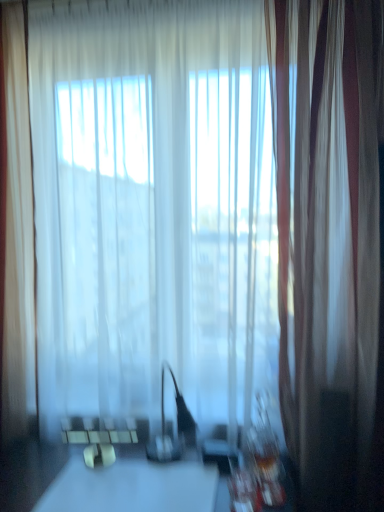
The image size is (384, 512). What do you see at coordinates (230, 247) in the screenshot?
I see `transparent fabric at center` at bounding box center [230, 247].

You are a GUI agent. You are given a task and a screenshot of the screen. Output one action in this format:
    pyautogui.click(x=<x>, y=<y>)
    Task: Click on the translucent white curtain at left, the first curtain positioned from the left
    
    Given the screenshot: What is the action you would take?
    pyautogui.click(x=18, y=240)

This screenshot has width=384, height=512. In order to click on transparent fabric at center in this screenshot , I will do tap(230, 247).

In order to click on the 1st curtain behind the white glossy table at center, counting from the anchor's position in this screenshot , I will do `click(330, 245)`.

Considering the sizes of objects white glossy table at center and silky white curtain at right, the second curtain in the left-to-right sequence, in the image provided, who is bigger, white glossy table at center or silky white curtain at right, the second curtain in the left-to-right sequence,?

With larger size is silky white curtain at right, the second curtain in the left-to-right sequence.

From the picture: From a real-world perspective, who is located higher, white glossy table at center or silky white curtain at right, the first curtain in the right-to-left sequence?

silky white curtain at right, the first curtain in the right-to-left sequence, from a real-world perspective.

Does white glossy table at center have a lesser height compared to silky white curtain at right, the first curtain in the right-to-left sequence?

Correct, white glossy table at center is not as tall as silky white curtain at right, the first curtain in the right-to-left sequence.

Based on the photo, from a real-world perspective, is transparent fabric at center below silky white curtain at right, the second curtain in the left-to-right sequence?

No, from a real-world perspective, transparent fabric at center is not below silky white curtain at right, the second curtain in the left-to-right sequence.

Would you say silky white curtain at right, the second curtain in the left-to-right sequence, is part of transparent fabric at center's contents?

Definitely not — silky white curtain at right, the second curtain in the left-to-right sequence, is not inside transparent fabric at center.

Which of these two, transparent fabric at center or silky white curtain at right, the second curtain in the left-to-right sequence, is smaller?

silky white curtain at right, the second curtain in the left-to-right sequence, is smaller.

Is point (72, 155) farther from camera compared to point (380, 80)?

Yes, point (72, 155) is farther from viewer.

From the image's perspective, is silky white curtain at right, the first curtain in the right-to-left sequence, located above or below transparent fabric at center?

Based on their image positions, silky white curtain at right, the first curtain in the right-to-left sequence, is located beneath transparent fabric at center.

Between silky white curtain at right, the first curtain in the right-to-left sequence, and transparent fabric at center, which one has larger size?

With larger size is transparent fabric at center.

Which object is thinner, silky white curtain at right, the first curtain in the right-to-left sequence, or transparent fabric at center?

Thinner between the two is transparent fabric at center.

Locate an element on the screen. The image size is (384, 512). table located below the translucent white curtain at left, the first curtain positioned from the left (from the image's perspective) is located at coordinates (132, 485).

Looking at this image, does white glossy table at center lie behind translucent white curtain at left, arranged as the second curtain when viewed from the right?

No, it is not.

Does white glossy table at center touch translucent white curtain at left, arranged as the second curtain when viewed from the right?

No, white glossy table at center is not making contact with translucent white curtain at left, arranged as the second curtain when viewed from the right.

Based on the photo, how many degrees apart are the facing directions of white glossy table at center and translucent white curtain at left, the first curtain positioned from the left?

The angular difference between white glossy table at center and translucent white curtain at left, the first curtain positioned from the left, is 1.57 degrees.

From the image's perspective, is white glossy table at center beneath transparent fabric at center?

Yes, from the image's perspective, white glossy table at center is beneath transparent fabric at center.

Measure the distance from white glossy table at center to transparent fabric at center.

white glossy table at center and transparent fabric at center are 26.59 inches apart.

Who is bigger, white glossy table at center or transparent fabric at center?

transparent fabric at center is bigger.

Which object is further away from the camera taking this photo, white glossy table at center or transparent fabric at center?

transparent fabric at center is behind.

Considering the sizes of objects silky white curtain at right, the second curtain in the left-to-right sequence, and white glossy table at center in the image provided, who is thinner, silky white curtain at right, the second curtain in the left-to-right sequence, or white glossy table at center?

With smaller width is silky white curtain at right, the second curtain in the left-to-right sequence.

Considering the positions of points (346, 273) and (112, 504), is point (346, 273) farther from camera compared to point (112, 504)?

Yes.

In the image, is silky white curtain at right, the first curtain in the right-to-left sequence, on the left side or the right side of white glossy table at center?

In the image, silky white curtain at right, the first curtain in the right-to-left sequence, appears on the right side of white glossy table at center.

From a real-world perspective, is silky white curtain at right, the second curtain in the left-to-right sequence, on white glossy table at center?

Yes, from a real-world perspective, silky white curtain at right, the second curtain in the left-to-right sequence, is above white glossy table at center.

Between transparent fabric at center and translucent white curtain at left, the first curtain positioned from the left, which one has less height?

transparent fabric at center.

From the image's perspective, which object appears higher, transparent fabric at center or translucent white curtain at left, arranged as the second curtain when viewed from the right?

translucent white curtain at left, arranged as the second curtain when viewed from the right.

Does transparent fabric at center contain translucent white curtain at left, the first curtain positioned from the left?

No, translucent white curtain at left, the first curtain positioned from the left, is not a part of transparent fabric at center.

Considering the sizes of transparent fabric at center and translucent white curtain at left, the first curtain positioned from the left, in the image, is transparent fabric at center wider or thinner than translucent white curtain at left, the first curtain positioned from the left,?

In the image, transparent fabric at center appears to be more narrow than translucent white curtain at left, the first curtain positioned from the left.

I want to click on the 1st curtain directly above the white glossy table at center (from a real-world perspective), so click(330, 245).

The width and height of the screenshot is (384, 512). Find the location of `bay window above the silky white curtain at right, the first curtain in the right-to-left sequence (from the image's perspective)`. bay window above the silky white curtain at right, the first curtain in the right-to-left sequence (from the image's perspective) is located at coordinates (230, 247).

Based on their spatial positions, is transparent fabric at center or silky white curtain at right, the second curtain in the left-to-right sequence, further from white glossy table at center?

silky white curtain at right, the second curtain in the left-to-right sequence, is further to white glossy table at center.

Which object lies further to the anchor point white glossy table at center, silky white curtain at right, the second curtain in the left-to-right sequence, or transparent fabric at center?

Among the two, silky white curtain at right, the second curtain in the left-to-right sequence, is located further to white glossy table at center.

Estimate the real-world distances between objects in this image. Which object is further from transparent fabric at center, white glossy table at center or translucent white curtain at left, the first curtain positioned from the left?

white glossy table at center.

Considering their positions, is translucent white curtain at left, the first curtain positioned from the left, positioned further to transparent fabric at center than silky white curtain at right, the first curtain in the right-to-left sequence?

Based on the image, translucent white curtain at left, the first curtain positioned from the left, appears to be further to transparent fabric at center.

Looking at this image, considering their positions, is translucent white curtain at left, arranged as the second curtain when viewed from the right, positioned further to silky white curtain at right, the second curtain in the left-to-right sequence, than white glossy table at center?

Among the two, translucent white curtain at left, arranged as the second curtain when viewed from the right, is located further to silky white curtain at right, the second curtain in the left-to-right sequence.

Looking at the image, which one is located further to translucent white curtain at left, arranged as the second curtain when viewed from the right, transparent fabric at center or white glossy table at center?

Among the two, white glossy table at center is located further to translucent white curtain at left, arranged as the second curtain when viewed from the right.

From the image, which object appears to be farther from transparent fabric at center, silky white curtain at right, the second curtain in the left-to-right sequence, or translucent white curtain at left, the first curtain positioned from the left?

translucent white curtain at left, the first curtain positioned from the left, lies further to transparent fabric at center than the other object.

Considering their positions, is transparent fabric at center positioned closer to translucent white curtain at left, the first curtain positioned from the left, than silky white curtain at right, the first curtain in the right-to-left sequence?

transparent fabric at center.

At what (x,y) coordinates should I click in order to perform the action: click on bay window between translucent white curtain at left, the first curtain positioned from the left, and white glossy table at center, in the vertical direction. Please return your answer as a coordinate pair (x, y). Image resolution: width=384 pixels, height=512 pixels. Looking at the image, I should click on (230, 247).

At what (x,y) coordinates should I click in order to perform the action: click on curtain that lies between transparent fabric at center and white glossy table at center from top to bottom. Please return your answer as a coordinate pair (x, y). Looking at the image, I should click on (330, 245).

I want to click on table between translucent white curtain at left, arranged as the second curtain when viewed from the right, and silky white curtain at right, the first curtain in the right-to-left sequence, from left to right, so click(132, 485).

Find the location of a particular element. This screenshot has width=384, height=512. bay window situated between translucent white curtain at left, the first curtain positioned from the left, and silky white curtain at right, the first curtain in the right-to-left sequence, from left to right is located at coordinates (230, 247).